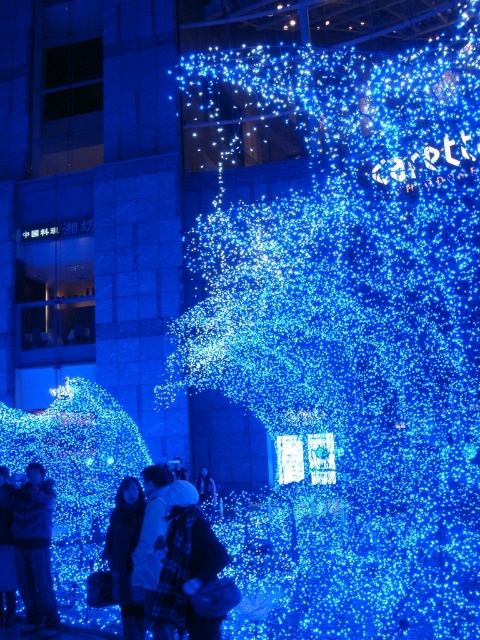
Is matte black jacket at lower left taller than white woolen hat at lower left?

Correct, matte black jacket at lower left is much taller as white woolen hat at lower left.

Is matte black jacket at lower left in front of white woolen hat at lower left?

Yes, matte black jacket at lower left is in front of white woolen hat at lower left.

Where is `matte black jacket at lower left`? The height and width of the screenshot is (640, 480). matte black jacket at lower left is located at coordinates (34, 545).

At what (x,y) coordinates should I click in order to perform the action: click on matte black jacket at lower left. Please return your answer as a coordinate pair (x, y). Looking at the image, I should click on (34, 545).

In the scene shown: Does white woolen hat at lower left appear on the right side of white matte jacket at center?

In fact, white woolen hat at lower left is to the left of white matte jacket at center.

Which is behind, point (12, 541) or point (207, 493)?

The point (207, 493) is more distant.

The image size is (480, 640). Find the location of `white woolen hat at lower left`. white woolen hat at lower left is located at coordinates (7, 570).

This screenshot has height=640, width=480. In order to click on dark blue fabric coat at center in this screenshot , I will do `click(126, 554)`.

Does dark blue fabric coat at center have a smaller size compared to white matte jacket at center?

No.

The height and width of the screenshot is (640, 480). Describe the element at coordinates (126, 554) in the screenshot. I see `dark blue fabric coat at center` at that location.

At what (x,y) coordinates should I click in order to perform the action: click on dark blue fabric coat at center. Please return your answer as a coordinate pair (x, y). Looking at the image, I should click on (126, 554).